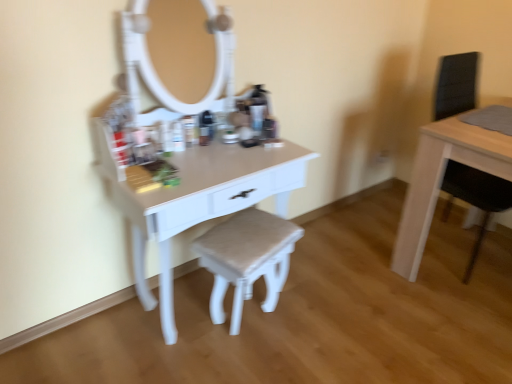
Where is `vacant area that lies to the right of matte white stool at center`? This screenshot has width=512, height=384. vacant area that lies to the right of matte white stool at center is located at coordinates (317, 322).